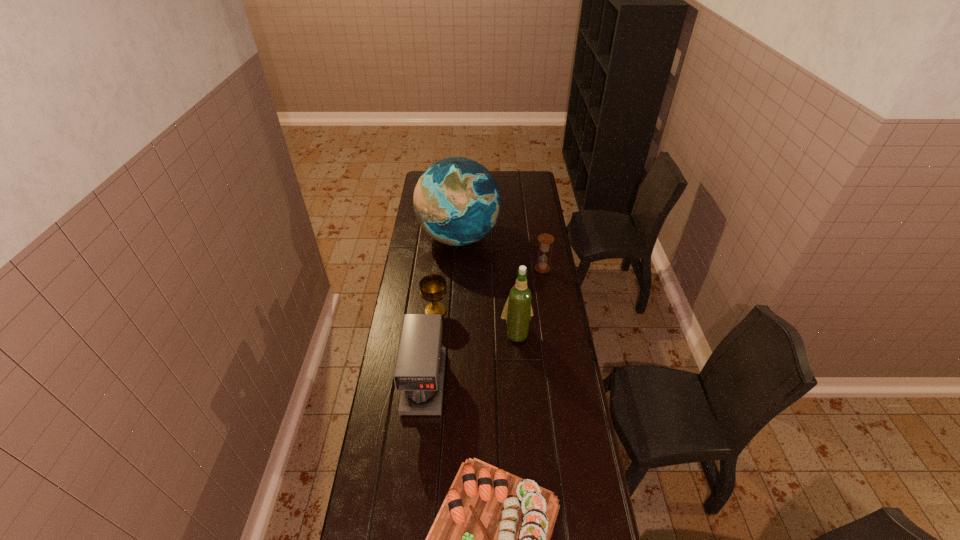
At what (x,y) coordinates should I click in order to perform the action: click on globe. Please return your answer as a coordinate pair (x, y). This screenshot has width=960, height=540. Looking at the image, I should click on (457, 201).

At what (x,y) coordinates should I click in order to perform the action: click on wine bottle. Please return your answer as a coordinate pair (x, y). Looking at the image, I should click on (517, 311).

Image resolution: width=960 pixels, height=540 pixels. Identify the location of the third tallest object. (419, 370).

Find the location of `the second nearest object`. the second nearest object is located at coordinates (419, 370).

Locate an element on the screen. The height and width of the screenshot is (540, 960). the rightmost object is located at coordinates (545, 240).

Identify the location of the fourth nearest object. (432, 287).

Locate an element on the screen. vacant space located 0.090m on the front of the globe is located at coordinates (457, 276).

Identify the location of free location located on the front-facing side of the third nearest object. The height and width of the screenshot is (540, 960). (522, 408).

Where is `free space located on the carafe side of the fourth shortest object`? This screenshot has width=960, height=540. free space located on the carafe side of the fourth shortest object is located at coordinates (408, 535).

Where is `vacant region located on the front of the hourglass`? vacant region located on the front of the hourglass is located at coordinates (547, 301).